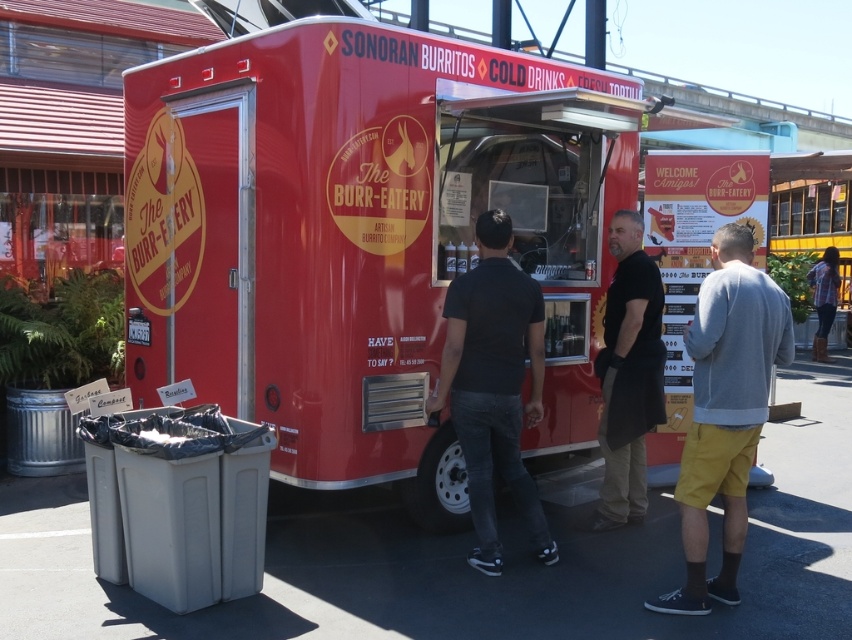
You are standing in front of the food truck and want to know which of the two points, point [815,284] or point [45,532], is closer to you. Based on the scene, can you determine which point is nearer?

Point [45,532] is closer to you because it is positioned closer to the camera than point [815,284].